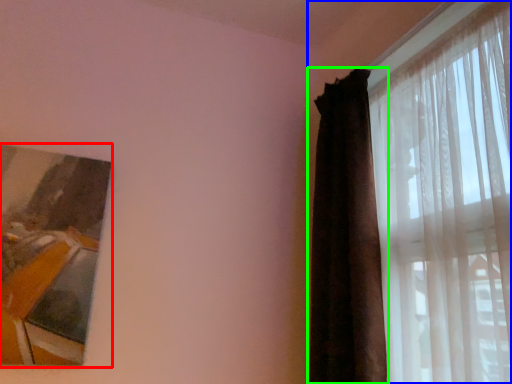
Question: Which object is positioned closest to picture frame (highlighted by a red box)? Select from curtain (highlighted by a blue box) and curtain (highlighted by a green box).

Choices:
 (A) curtain
 (B) curtain

Answer: (B)